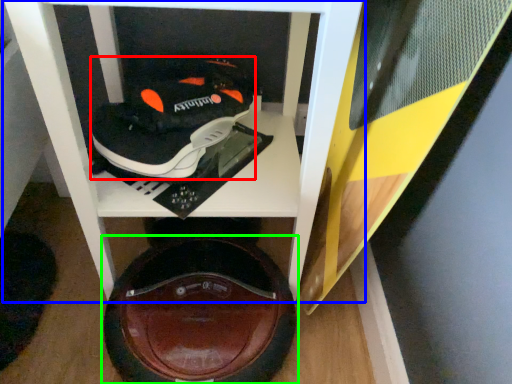
Question: Based on their relative distances, which object is farther from shoe (highlighted by a red box)? Choose from furniture (highlighted by a blue box) and footwear (highlighted by a green box).

Choices:
 (A) furniture
 (B) footwear

Answer: (B)